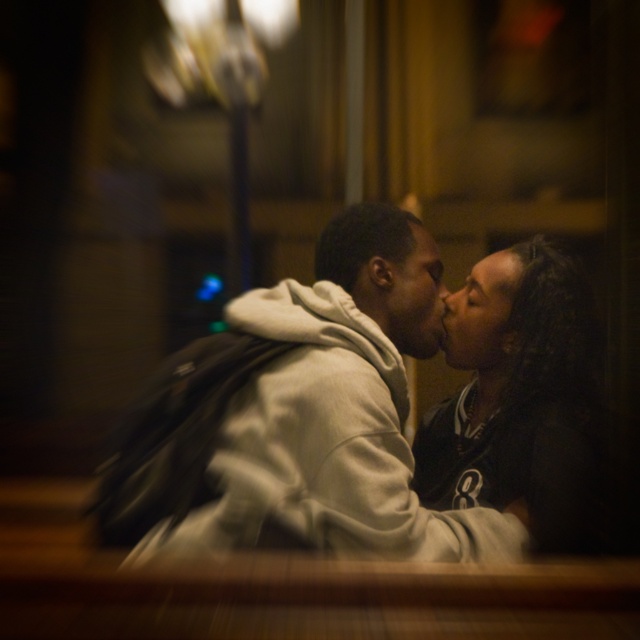
In the scene shown: Is light gray hoodie at center bigger than dark blue jersey at center?

Yes, light gray hoodie at center is bigger than dark blue jersey at center.

Based on the photo, which is more to the left, light gray hoodie at center or dark blue jersey at center?

light gray hoodie at center

Is point (289, 401) farther from viewer compared to point (516, 419)?

No, (289, 401) is in front of (516, 419).

Where is `light gray hoodie at center`? This screenshot has height=640, width=640. light gray hoodie at center is located at coordinates (336, 412).

Based on the photo, between light gray hoodie at center and matte black forehead at upper center, which one is positioned lower?

light gray hoodie at center is below.

In order to click on light gray hoodie at center in this screenshot , I will do `click(336, 412)`.

At what (x,y) coordinates should I click in order to perform the action: click on light gray hoodie at center. Please return your answer as a coordinate pair (x, y). Looking at the image, I should click on (336, 412).

Who is shorter, dark blue jersey at center or matte black forehead at upper center?

matte black forehead at upper center is shorter.

Who is more forward, (570, 358) or (481, 282)?

Point (570, 358)

Locate an element on the screen. dark blue jersey at center is located at coordinates (522, 406).

Find the location of a particular element. This screenshot has height=640, width=640. dark blue jersey at center is located at coordinates (522, 406).